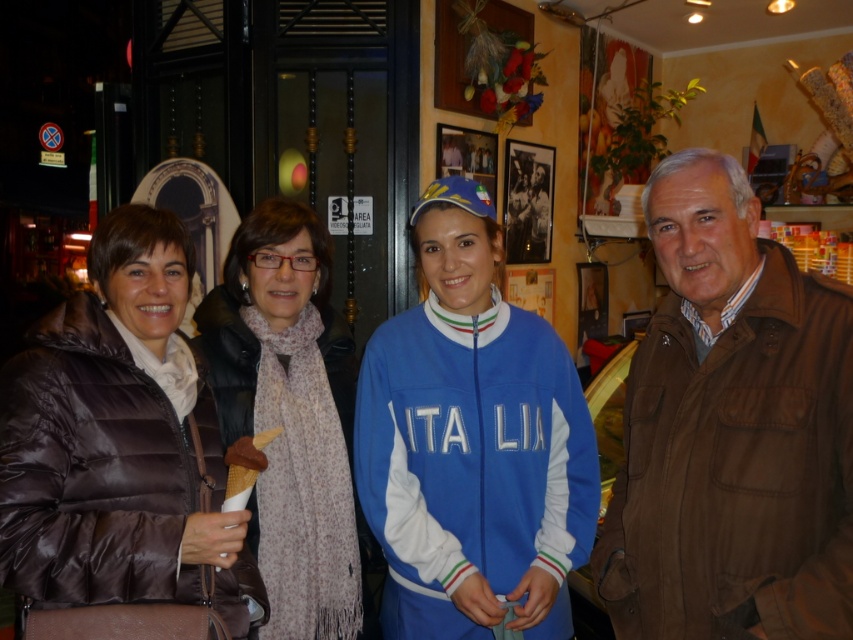
Measure the distance between brown leather jacket at right and brown quilted jacket at center.

17.40 inches

Which is behind, point (759, 260) or point (437, 380)?

Positioned behind is point (437, 380).

You are a GUI agent. You are given a task and a screenshot of the screen. Output one action in this format:
    pyautogui.click(x=<x>, y=<y>)
    Task: Click on the brown leather jacket at right
    This screenshot has height=640, width=853.
    Given the screenshot: What is the action you would take?
    pyautogui.click(x=730, y=429)

Is brown leather jacket at right below brown quilted jacket at left?

Incorrect, brown leather jacket at right is not positioned below brown quilted jacket at left.

Looking at this image, does brown leather jacket at right have a lesser height compared to brown quilted jacket at left?

No.

Is point (805, 636) positioned behind point (122, 269)?

That is False.

Locate an element on the screen. Image resolution: width=853 pixels, height=640 pixels. brown leather jacket at right is located at coordinates (730, 429).

Can you confirm if brown leather jacket at right is positioned above light brown scarf at center?

Yes.

Does brown leather jacket at right have a greater width compared to light brown scarf at center?

No.

What do you see at coordinates (730, 429) in the screenshot? I see `brown leather jacket at right` at bounding box center [730, 429].

The image size is (853, 640). In order to click on brown leather jacket at right in this screenshot , I will do `click(730, 429)`.